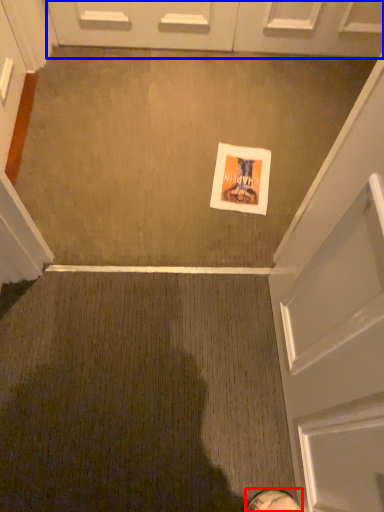
Question: Which object appears closest to the camera in this image, footwear (highlighted by a red box) or door (highlighted by a blue box)?

Choices:
 (A) footwear
 (B) door

Answer: (A)